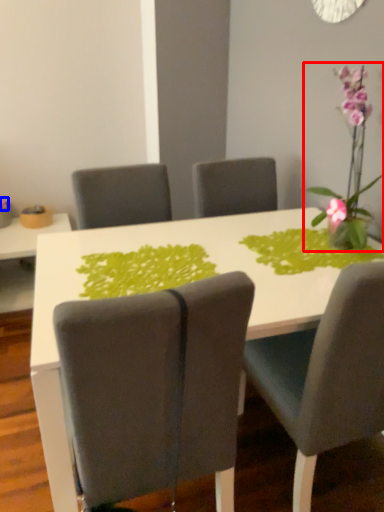
Question: Which of the following is the farthest to the observer, houseplant (highlighted by a red box) or flower (highlighted by a blue box)?

Choices:
 (A) houseplant
 (B) flower

Answer: (B)